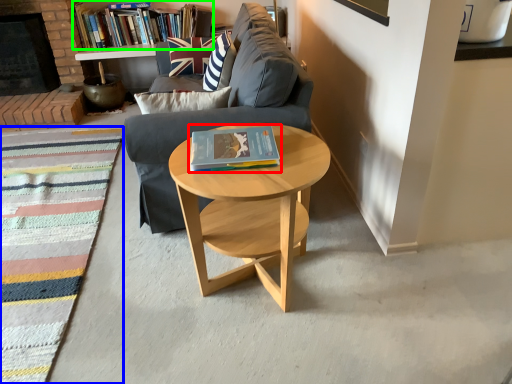
Question: Estimate the real-world distances between objects in this image. Which object is closer to book (highlighted by a red box), mat (highlighted by a blue box) or book (highlighted by a green box)?

Choices:
 (A) mat
 (B) book

Answer: (A)